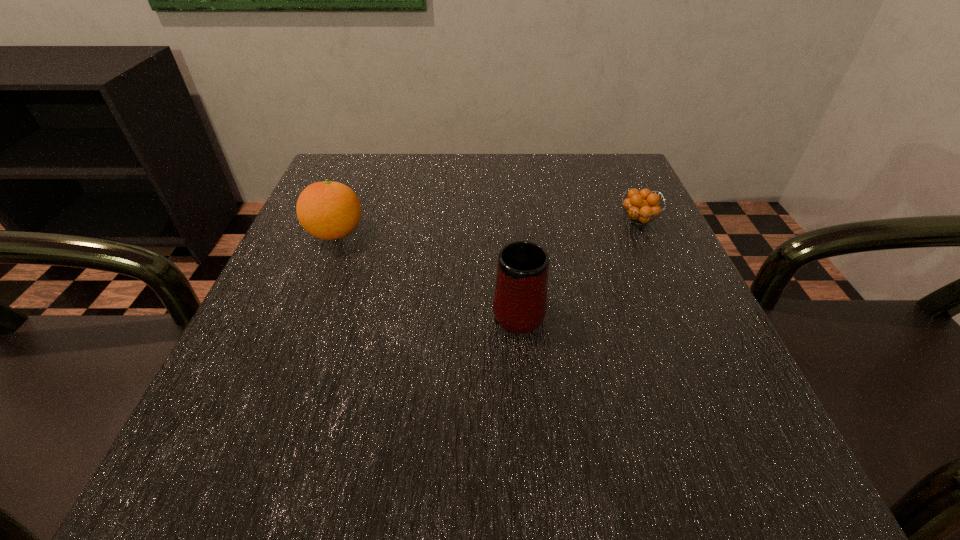
This screenshot has width=960, height=540. Find the location of `unoccupied position between the mug and the leftmost object`. unoccupied position between the mug and the leftmost object is located at coordinates (427, 271).

Where is `free space between the taller orange fruit and the rightmost object`? The image size is (960, 540). free space between the taller orange fruit and the rightmost object is located at coordinates (488, 227).

At what (x,y) coordinates should I click in order to perform the action: click on free point between the second object from right to left and the right orange fruit. Please return your answer as a coordinate pair (x, y). The height and width of the screenshot is (540, 960). Looking at the image, I should click on point(579,264).

The width and height of the screenshot is (960, 540). I want to click on object that stands as the closest to the second object from right to left, so click(x=642, y=206).

Where is `object that stands as the second closest to the shorter orange fruit`? The width and height of the screenshot is (960, 540). object that stands as the second closest to the shorter orange fruit is located at coordinates (328, 210).

At what (x,y) coordinates should I click in order to perform the action: click on vacant point that satisfies the following two spatial constraints: 1. on the back side of the taller orange fruit; 2. on the left side of the shorter orange fruit. Please return your answer as a coordinate pair (x, y). Looking at the image, I should click on coord(341,220).

The width and height of the screenshot is (960, 540). I want to click on free spot that satisfies the following two spatial constraints: 1. on the side of the nearest object with the handle; 2. on the left side of the shorter orange fruit, so [511, 220].

What are the coordinates of `vacant space that satisfies the following two spatial constraints: 1. on the side of the rightmost object with the handle; 2. on the right side of the mug` in the screenshot? It's located at (511, 220).

This screenshot has width=960, height=540. Find the location of `free space that satisfies the following two spatial constraints: 1. on the side of the shorter orange fruit with the handle; 2. on the left side of the nearest object`. free space that satisfies the following two spatial constraints: 1. on the side of the shorter orange fruit with the handle; 2. on the left side of the nearest object is located at coordinates (x=511, y=220).